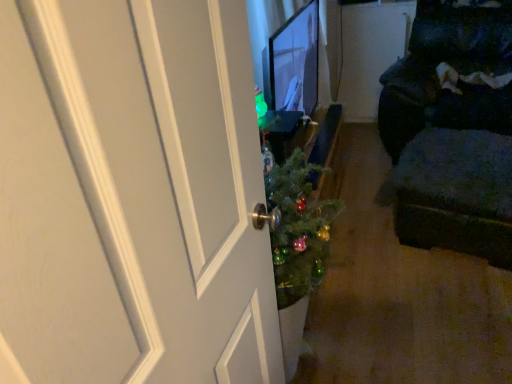
Question: Should I look upward or downward to see matte black monitor at center?

Choices:
 (A) up
 (B) down

Answer: (A)

Question: Would you say matte black monitor at center is part of dark fabric couch at right's contents?

Choices:
 (A) yes
 (B) no

Answer: (B)

Question: From the image's perspective, would you say dark fabric couch at right is positioned over matte black monitor at center?

Choices:
 (A) yes
 (B) no

Answer: (A)

Question: Is dark fabric couch at right shorter than matte black monitor at center?

Choices:
 (A) no
 (B) yes

Answer: (A)

Question: Is dark fabric couch at right taller than matte black monitor at center?

Choices:
 (A) yes
 (B) no

Answer: (A)

Question: Does dark fabric couch at right have a greater width compared to matte black monitor at center?

Choices:
 (A) no
 (B) yes

Answer: (B)

Question: Can you confirm if dark fabric couch at right is thinner than matte black monitor at center?

Choices:
 (A) yes
 (B) no

Answer: (B)

Question: Can you confirm if matte black monitor at center is bigger than dark fabric couch at right?

Choices:
 (A) yes
 (B) no

Answer: (B)

Question: Considering the relative positions of matte black monitor at center and dark fabric couch at right in the image provided, is matte black monitor at center to the right of dark fabric couch at right from the viewer's perspective?

Choices:
 (A) yes
 (B) no

Answer: (B)

Question: From the image's perspective, is matte black monitor at center located beneath dark fabric couch at right?

Choices:
 (A) no
 (B) yes

Answer: (B)

Question: Can you confirm if matte black monitor at center is wider than dark fabric couch at right?

Choices:
 (A) yes
 (B) no

Answer: (B)

Question: Is matte black monitor at center positioned with its back to dark fabric couch at right?

Choices:
 (A) yes
 (B) no

Answer: (B)

Question: From a real-world perspective, is matte black monitor at center over dark fabric couch at right?

Choices:
 (A) no
 (B) yes

Answer: (B)

Question: From the image's perspective, is dark fabric ottoman at right located beneath dark fabric couch at right?

Choices:
 (A) yes
 (B) no

Answer: (A)